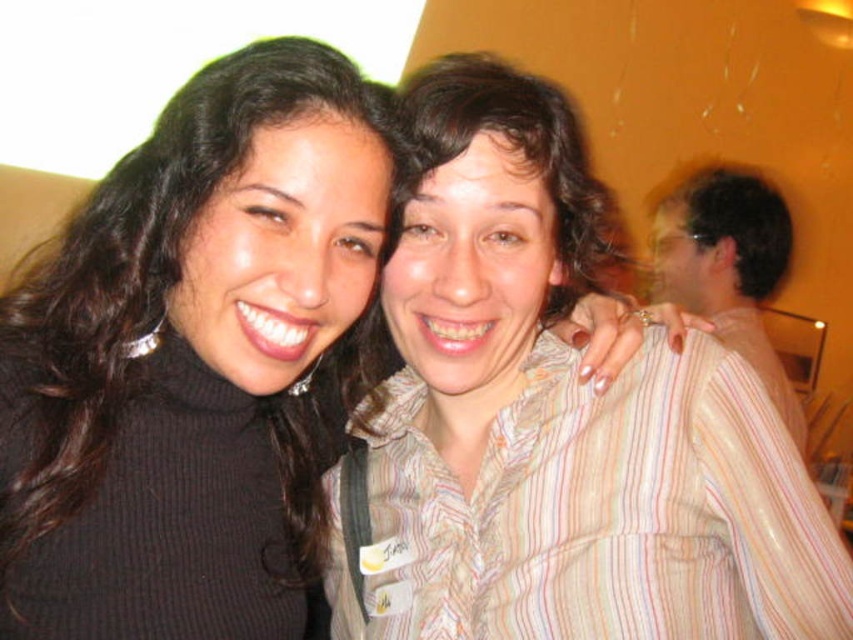
Who is more forward, (422, 497) or (706, 182)?

Point (422, 497)

Looking at this image, which is above, striped cotton shirt at center or striped shirt at right?

striped shirt at right is higher up.

At what (x,y) coordinates should I click in order to perform the action: click on striped cotton shirt at center. Please return your answer as a coordinate pair (x, y). The image size is (853, 640). Looking at the image, I should click on (555, 424).

Find the location of a particular element. striped cotton shirt at center is located at coordinates (555, 424).

Does striped cotton shirt at center have a lesser width compared to black ribbed turtleneck sweater at left?

No.

Does striped cotton shirt at center have a greater height compared to black ribbed turtleneck sweater at left?

Indeed, striped cotton shirt at center has a greater height compared to black ribbed turtleneck sweater at left.

Who is more distant from viewer, [502,276] or [112,310]?

Point [502,276]

This screenshot has height=640, width=853. I want to click on striped cotton shirt at center, so click(x=555, y=424).

Can you confirm if black ribbed turtleneck sweater at left is positioned to the right of striped shirt at right?

No, black ribbed turtleneck sweater at left is not to the right of striped shirt at right.

You are a GUI agent. You are given a task and a screenshot of the screen. Output one action in this format:
    pyautogui.click(x=<x>, y=<y>)
    Task: Click on the black ribbed turtleneck sweater at left
    
    Given the screenshot: What is the action you would take?
    pyautogui.click(x=195, y=362)